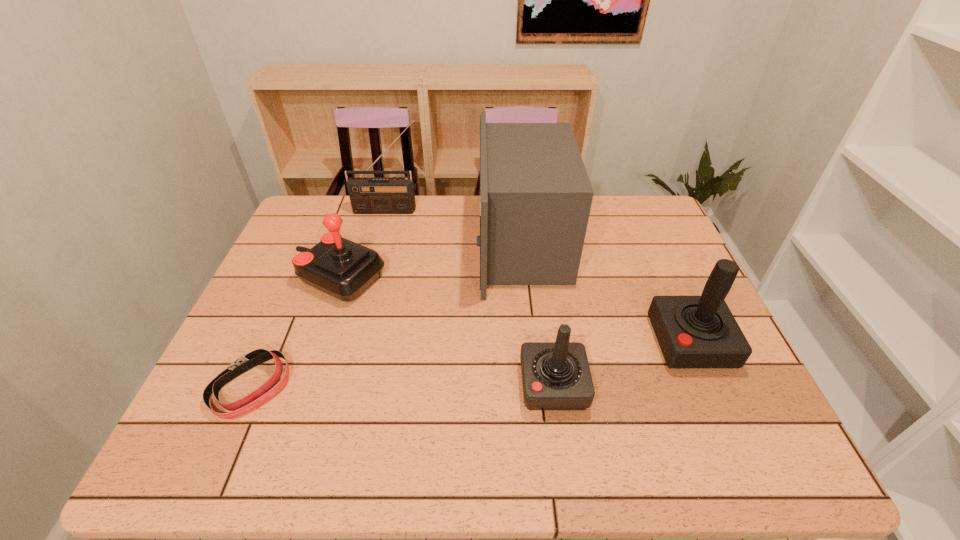
In order to click on joystick that is the second nearest to the leftmost joystick in this screenshot , I will do `click(692, 331)`.

Locate an element on the screen. The height and width of the screenshot is (540, 960). the closest joystick to the second joystick from right to left is located at coordinates [x=692, y=331].

You are a GUI agent. You are given a task and a screenshot of the screen. Output one action in this format:
    pyautogui.click(x=<x>, y=<y>)
    Task: Click on the vacant region that satisfies the following two spatial constraints: 1. on the front-facing side of the fifth tallest object; 2. on the front side of the dog collar
    
    Given the screenshot: What is the action you would take?
    pyautogui.click(x=554, y=388)